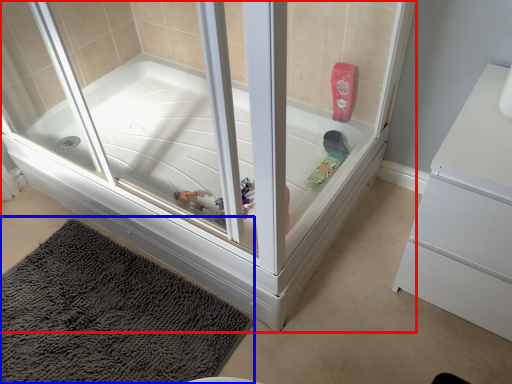
Question: Which of the following is the closest to the observer, bathtub (highlighted by a red box) or bath mat (highlighted by a blue box)?

Choices:
 (A) bathtub
 (B) bath mat

Answer: (A)